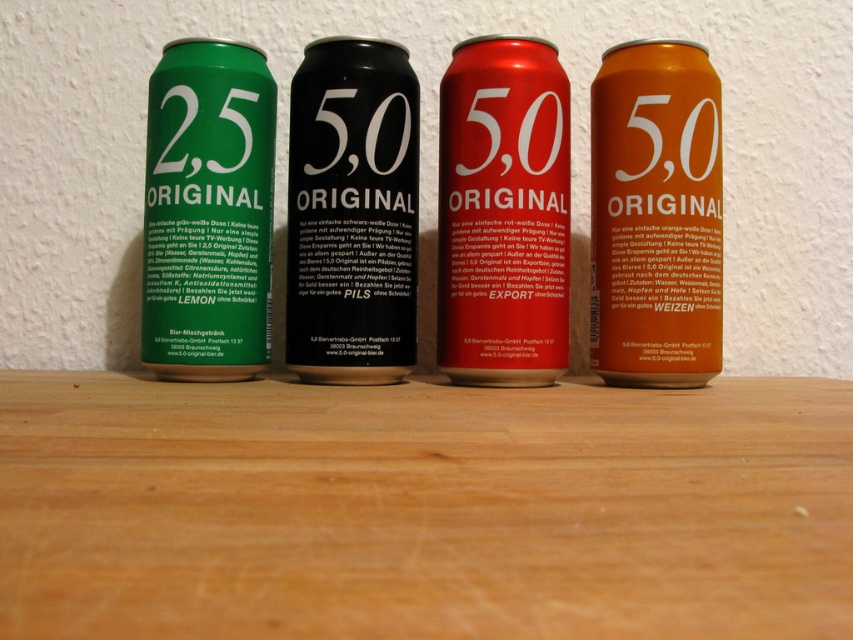
Question: Which point is farther to the camera?

Choices:
 (A) pyautogui.click(x=538, y=106)
 (B) pyautogui.click(x=666, y=173)
 (C) pyautogui.click(x=252, y=304)

Answer: (B)

Question: Which object appears closest to the camera in this image?

Choices:
 (A) black matte can at center
 (B) wooden table at lower center
 (C) shiny metallic can at center

Answer: (B)

Question: Where is shiny metallic can at center located in relation to black matte can at center in the image?

Choices:
 (A) right
 (B) left

Answer: (A)

Question: Is shiny metallic can at center to the right of black matte can at center from the viewer's perspective?

Choices:
 (A) no
 (B) yes

Answer: (B)

Question: Is wooden table at lower center bigger than black matte can at center?

Choices:
 (A) yes
 (B) no

Answer: (A)

Question: Which point is farther to the camera?

Choices:
 (A) orange matte can at center
 (B) green matte can at left

Answer: (A)